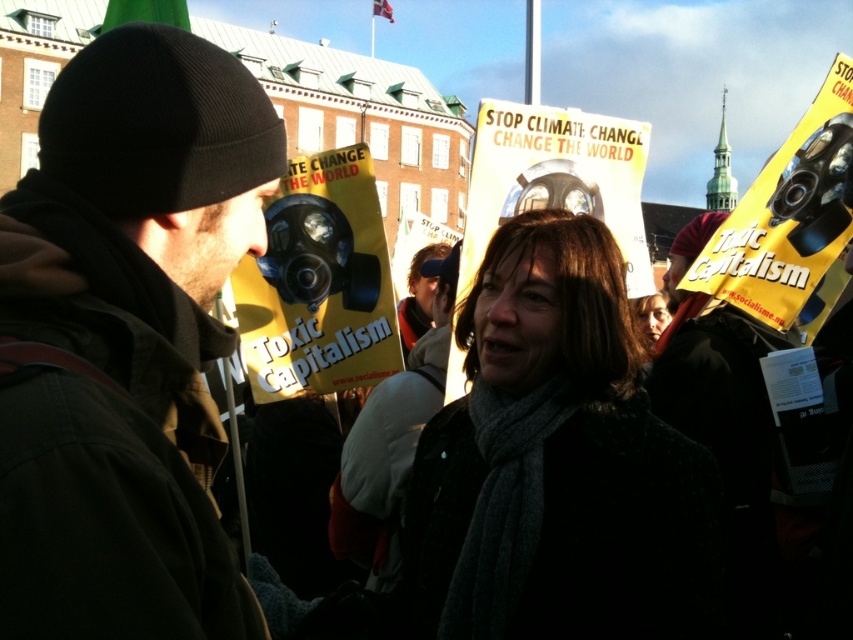
Where is `dark gray knit hat at center`? This screenshot has height=640, width=853. dark gray knit hat at center is located at coordinates (419, 296).

From the picture: Between dark gray knit hat at center and dark gray scarf at center, which one is positioned lower?

dark gray scarf at center

Describe the element at coordinates (419, 296) in the screenshot. I see `dark gray knit hat at center` at that location.

Find the location of a particular element. dark gray knit hat at center is located at coordinates (419, 296).

Looking at this image, who is more forward, [463,465] or [419,275]?

Positioned in front is point [463,465].

Is dark gray wool scarf at center to the right of dark gray knit hat at center from the viewer's perspective?

Yes, dark gray wool scarf at center is to the right of dark gray knit hat at center.

Locate an element on the screen. dark gray wool scarf at center is located at coordinates pyautogui.click(x=556, y=465).

Is the position of dark brown knit hat at upper left more distant than that of dark gray knit hat at center?

No, it is in front of dark gray knit hat at center.

Who is positioned more to the right, dark brown knit hat at upper left or dark gray knit hat at center?

Positioned to the right is dark gray knit hat at center.

At what (x,y) coordinates should I click in order to perform the action: click on dark brown knit hat at upper left. Please return your answer as a coordinate pair (x, y). Looking at the image, I should click on (128, 339).

Image resolution: width=853 pixels, height=640 pixels. Identify the location of dark brown knit hat at upper left. (128, 339).